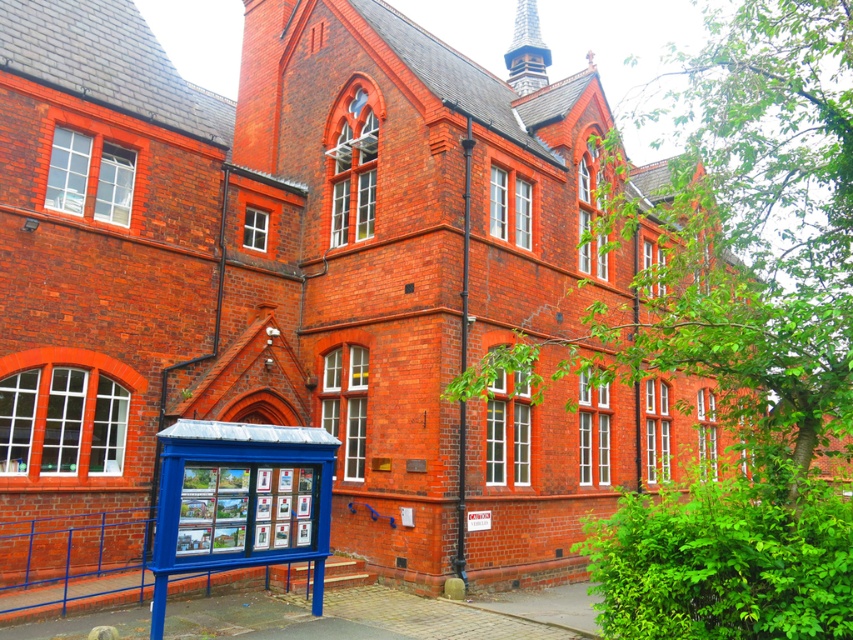
You are a tourist holding a map and standing in front of the red brick building. You see the blue metallic bus stop at lower left and the wooden spire at upper center. Which object is larger in size?

The wooden spire at upper center is larger than the blue metallic bus stop at lower left.

You are standing at the entrance of the building and want to find the nearest bus stop. Based on the image, where is the blue metallic bus stop at lower left located relative to your current position?

The blue metallic bus stop at lower left is located at point (241, 500) relative to your current position.